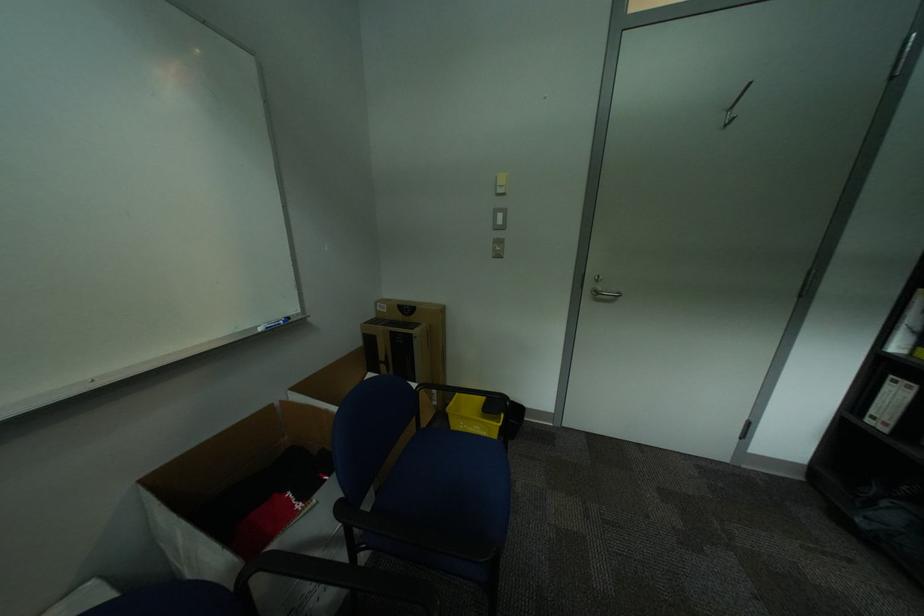
Locate an element on the screen. blue chair sitting surface is located at coordinates (450, 506).